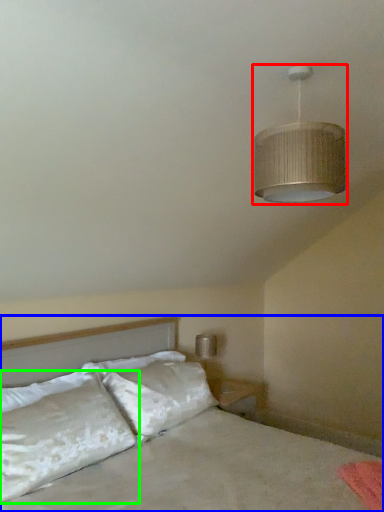
Question: Estimate the real-world distances between objects in this image. Which object is farther from lamp (highlighted by a red box), bed (highlighted by a blue box) or pillow (highlighted by a green box)?

Choices:
 (A) bed
 (B) pillow

Answer: (B)